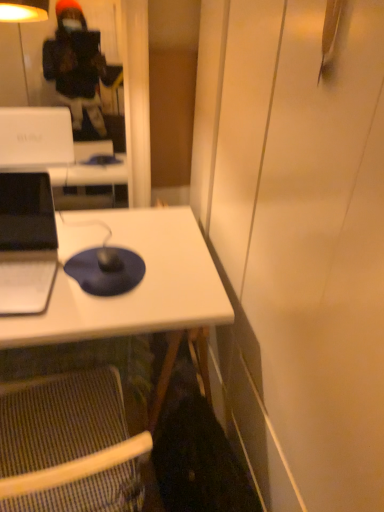
The image size is (384, 512). Find the location of `vacant space in blue matte mousepad at center (from a real-world perspective)`. vacant space in blue matte mousepad at center (from a real-world perspective) is located at coordinates (98, 270).